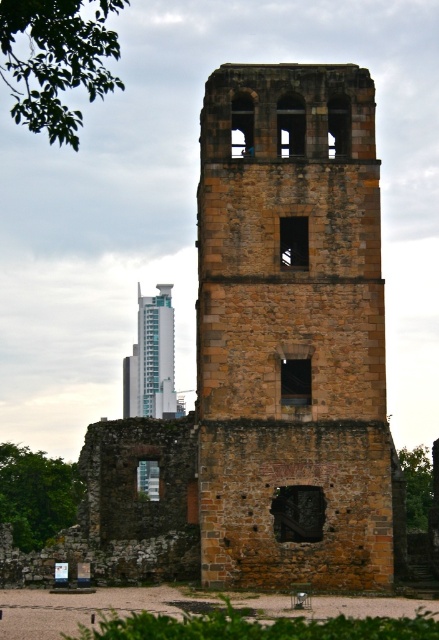
Question: Which of the following is the closest to the observer?

Choices:
 (A) (213, 314)
 (B) (21, 35)
 (C) (43, 540)

Answer: (A)

Question: Can you confirm if brown stone tower at center is positioned to the right of green leafy tree at lower left?

Choices:
 (A) no
 (B) yes

Answer: (B)

Question: Can you confirm if green leafy tree at lower left is bigger than green leafy tree at center?

Choices:
 (A) no
 (B) yes

Answer: (B)

Question: Which of the following is the farthest from the observer?

Choices:
 (A) brown stone tower at center
 (B) teal glass skyscraper at center
 (C) green leafy tree at lower left

Answer: (B)

Question: Does brown stone tower at center appear over teal glass skyscraper at center?

Choices:
 (A) yes
 (B) no

Answer: (B)

Question: Which object appears closest to the camera in this image?

Choices:
 (A) teal glass skyscraper at center
 (B) green leafy tree at center
 (C) green leafy tree at lower left

Answer: (C)